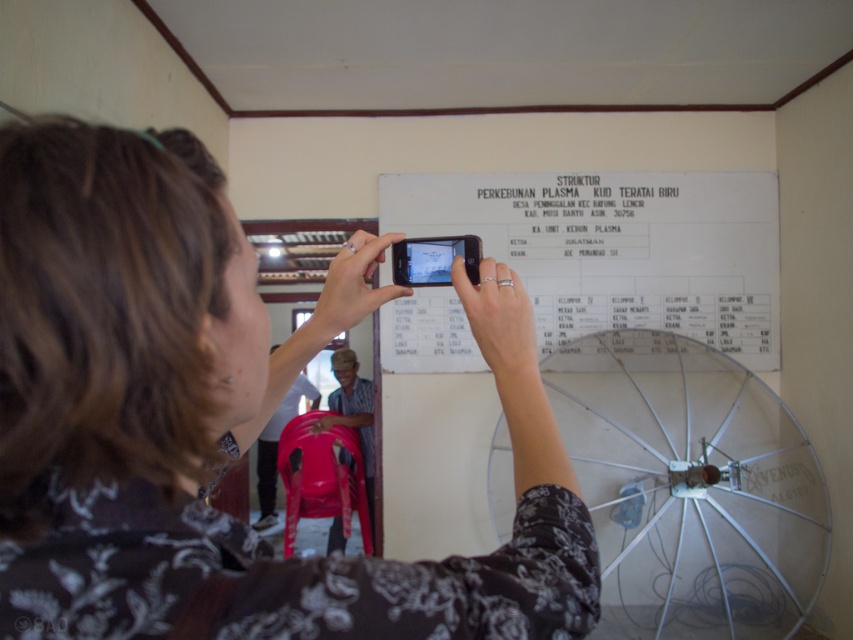
Does floral-patterned shirt at center have a greater width compared to metallic silver umbrella at center?

No.

Who is higher up, floral-patterned shirt at center or metallic silver umbrella at center?

Positioned higher is floral-patterned shirt at center.

The height and width of the screenshot is (640, 853). Describe the element at coordinates (216, 419) in the screenshot. I see `floral-patterned shirt at center` at that location.

Image resolution: width=853 pixels, height=640 pixels. I want to click on floral-patterned shirt at center, so click(x=216, y=419).

Can you confirm if metallic silver umbrella at center is wider than white paper at upper center?

No.

Which is behind, point (584, 445) or point (592, 224)?

Point (584, 445)

Between point (659, 358) and point (721, 211), which one is positioned behind?

The point (721, 211) is behind.

In order to click on metallic silver umbrella at center in this screenshot , I will do `click(689, 486)`.

Can you confirm if floral-patterned shirt at center is thinner than white paper at upper center?

Yes.

Is point (247, 241) farther from camera compared to point (392, 353)?

No, (247, 241) is in front of (392, 353).

Measure the distance between floral-patterned shirt at center and camera.

A distance of 13.28 inches exists between floral-patterned shirt at center and camera.

Identify the location of floral-patterned shirt at center. (216, 419).